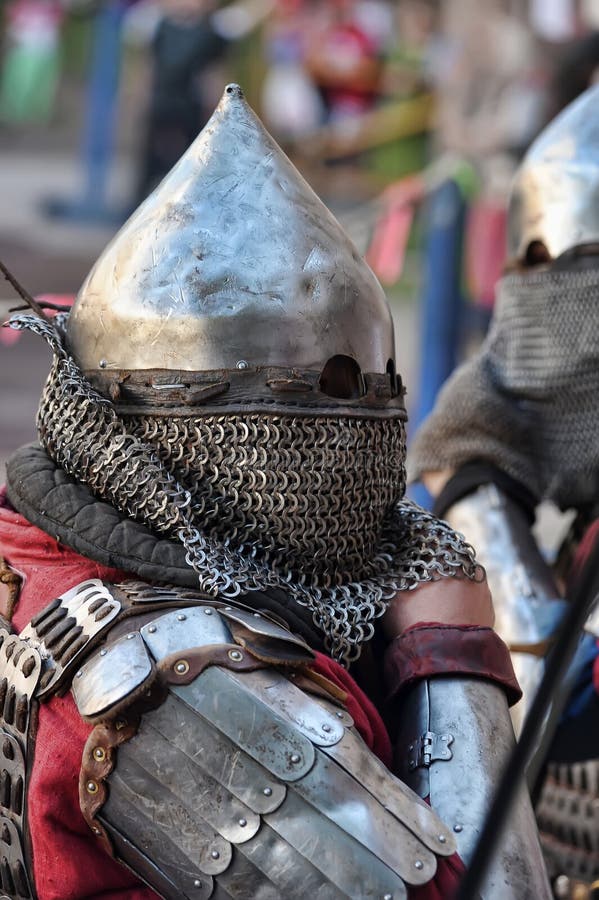
Locate an element on the screen. This screenshot has width=599, height=900. hinge is located at coordinates (428, 744).